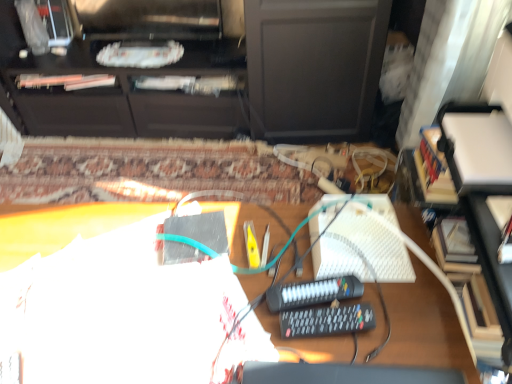
At what (x,y) coordinates should I click in order to perform the action: click on free space to the back side of black plastic remote control at center, arranged as the 1th equipment when viewed from the back. Please return your answer as a coordinate pair (x, y). Looking at the image, I should click on tap(285, 245).